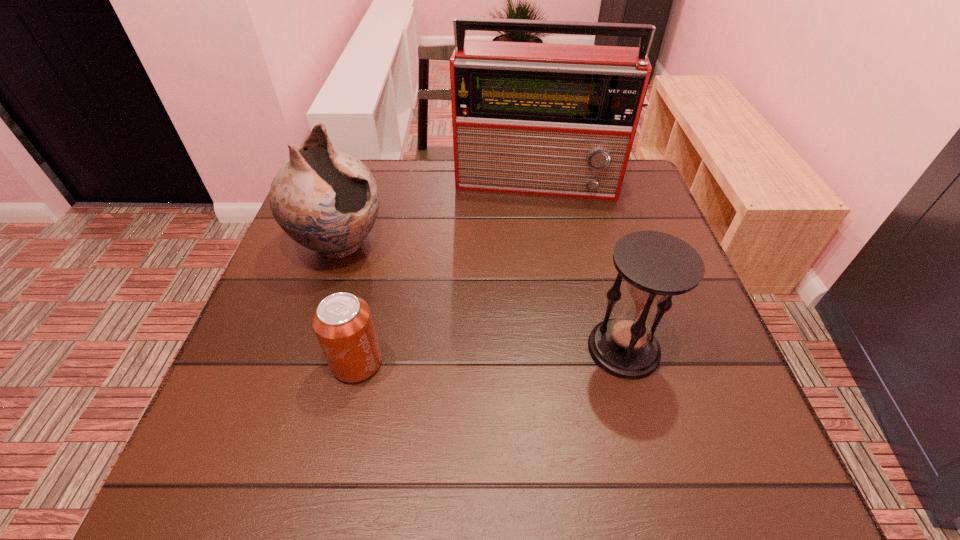
Where is `blank area located 0.280m from the spout of the third shortest object`? The height and width of the screenshot is (540, 960). blank area located 0.280m from the spout of the third shortest object is located at coordinates coord(470,324).

At what (x,y) coordinates should I click in order to perform the action: click on blank space located on the front-facing side of the radio receiver. Please return your answer as a coordinate pair (x, y). The width and height of the screenshot is (960, 540). Looking at the image, I should click on (525, 316).

Identify the location of vacant position located on the front-facing side of the radio receiver. The height and width of the screenshot is (540, 960). (526, 302).

This screenshot has height=540, width=960. Find the location of `blank space located 0.170m on the front-facing side of the radio receiver`. blank space located 0.170m on the front-facing side of the radio receiver is located at coordinates (530, 245).

The width and height of the screenshot is (960, 540). Identify the location of object positioned at the far edge. (x=547, y=119).

The height and width of the screenshot is (540, 960). Find the location of `object situated at the near edge`. object situated at the near edge is located at coordinates (342, 322).

Find the location of a particular element. The image size is (960, 540). object present at the left edge is located at coordinates (327, 200).

What are the coordinates of `hourglass positioned at the right edge` in the screenshot? It's located at (656, 266).

The height and width of the screenshot is (540, 960). I want to click on radio receiver present at the right edge, so click(547, 119).

At what (x,y) coordinates should I click in order to perform the action: click on object positioned at the far right corner. Please return your answer as a coordinate pair (x, y). Image resolution: width=960 pixels, height=540 pixels. Looking at the image, I should click on (547, 119).